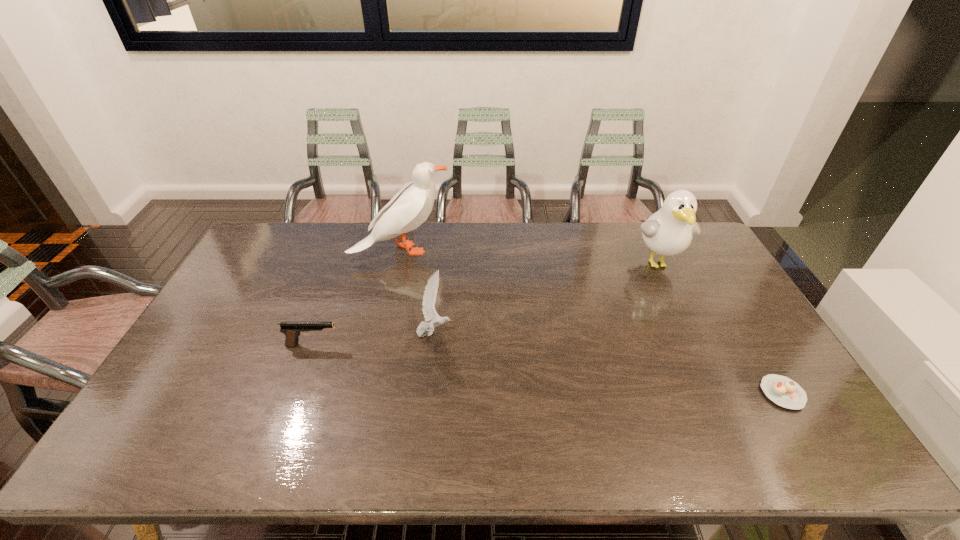
Where is `empty space that is in between the fourth object from left to right and the fourth tallest object`? empty space that is in between the fourth object from left to right and the fourth tallest object is located at coordinates (486, 303).

At what (x,y) coordinates should I click in order to perform the action: click on blank region between the shortest object and the pistol. Please return your answer as a coordinate pair (x, y). The width and height of the screenshot is (960, 540). Looking at the image, I should click on (548, 369).

This screenshot has width=960, height=540. In order to click on unoccupied area between the second object from right to left and the nearest object in this screenshot , I will do `click(720, 328)`.

I want to click on free area in between the nearest gull and the shortest object, so click(609, 363).

You are a GUI agent. You are given a task and a screenshot of the screen. Output one action in this format:
    pyautogui.click(x=<x>, y=<y>)
    Task: Click on the vacant region between the fourth object from left to right and the shortest object
    
    Given the screenshot: What is the action you would take?
    pyautogui.click(x=720, y=328)

Locate an element on the screen. free space between the shortest gull and the second shortest object is located at coordinates (373, 339).

The height and width of the screenshot is (540, 960). Find the location of `vacant space that's between the nearest object and the third shortest object`. vacant space that's between the nearest object and the third shortest object is located at coordinates (609, 363).

At what (x,y) coordinates should I click in order to perform the action: click on the third closest object to the nearest object. Please return your answer as a coordinate pair (x, y). Looking at the image, I should click on pyautogui.click(x=410, y=207).

Point out which object is positioned as the fourth nearest to the fourth tallest object. Please provide its 2D coordinates. Your answer should be formatted as a tuple, i.e. [(x, y)], where the tuple contains the x and y coordinates of a point satisfying the conditions above.

[(783, 391)]

At what (x,y) coordinates should I click in order to perform the action: click on gull that is the closest to the second object from right to left. Please return your answer as a coordinate pair (x, y). Looking at the image, I should click on (429, 298).